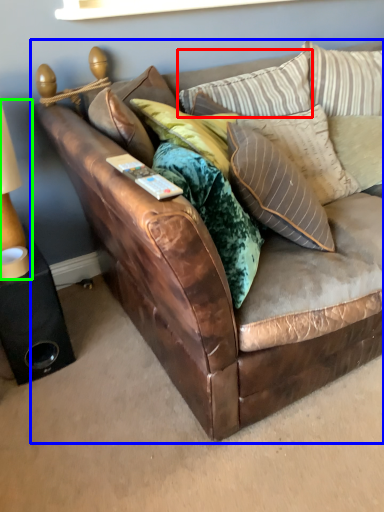
Question: Which object is the farthest from pillow (highlighted by a red box)? Choose among these: studio couch (highlighted by a blue box) or table lamp (highlighted by a green box).

Choices:
 (A) studio couch
 (B) table lamp

Answer: (B)